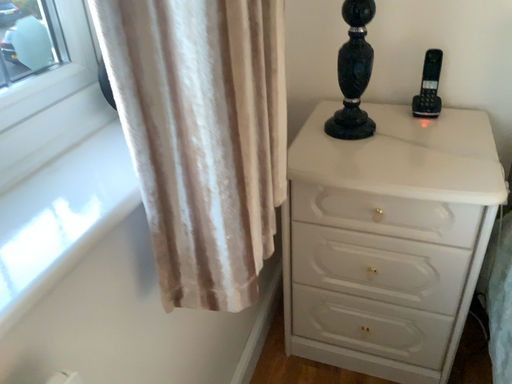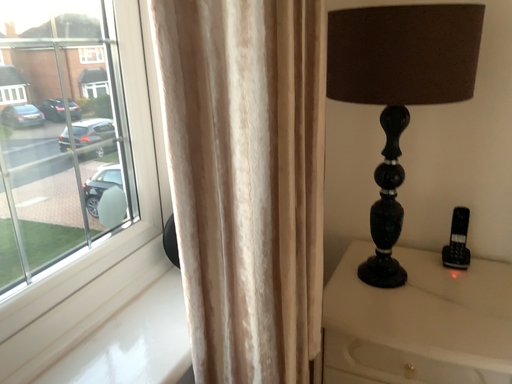
Question: Which way did the camera rotate in the video?

Choices:
 (A) rotated downward
 (B) rotated upward

Answer: (B)